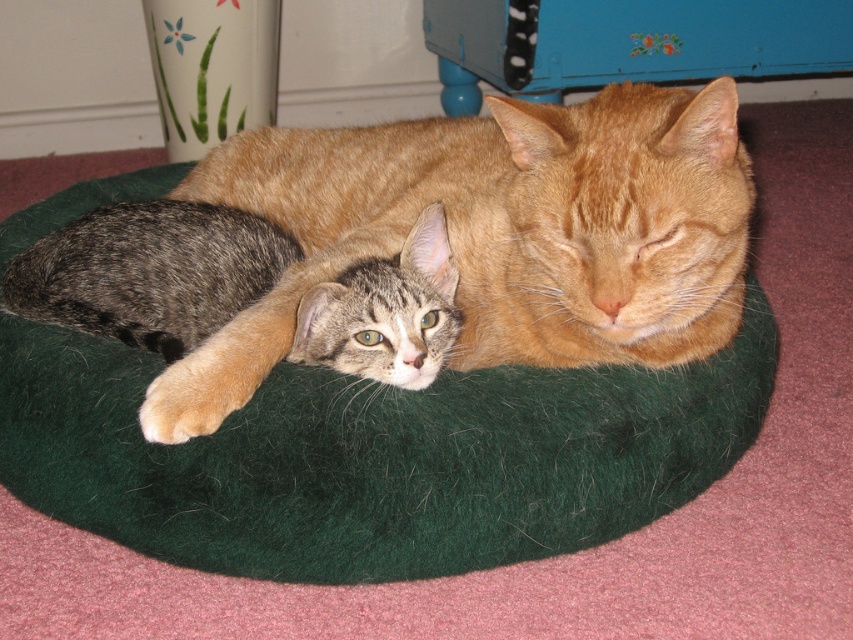
Question: Where is green felt cat bed at center located in relation to gray tabby kitten at center in the image?

Choices:
 (A) right
 (B) left

Answer: (A)

Question: Which of the following is the farthest from the observer?

Choices:
 (A) 73,416
 (B) 144,268

Answer: (B)

Question: Does green felt cat bed at center have a larger size compared to gray tabby kitten at center?

Choices:
 (A) no
 (B) yes

Answer: (B)

Question: In this image, where is green felt cat bed at center located relative to gray tabby kitten at center?

Choices:
 (A) above
 (B) below

Answer: (B)

Question: Which of the following is the closest to the observer?

Choices:
 (A) gray tabby kitten at center
 (B) green felt cat bed at center

Answer: (B)